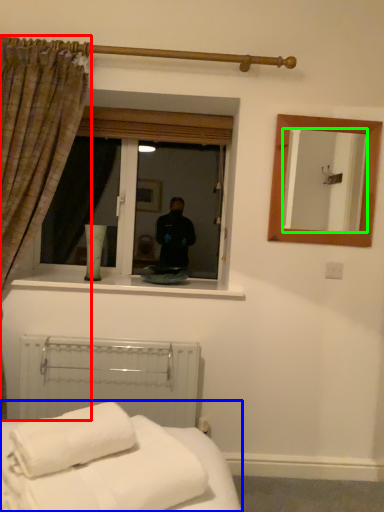
Question: Estimate the real-world distances between objects in this image. Which object is farther from curtain (highlighted by a red box), bed (highlighted by a blue box) or mirror (highlighted by a green box)?

Choices:
 (A) bed
 (B) mirror

Answer: (B)